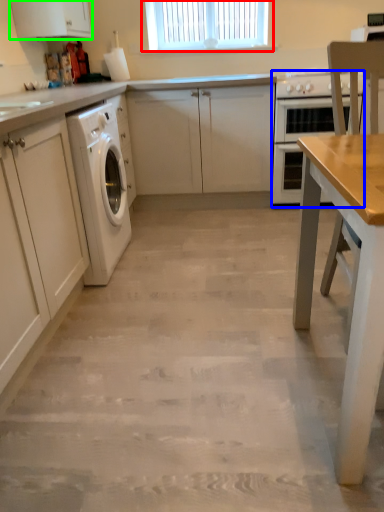
Question: Which object is positioned closest to window (highlighted by a red box)? Select from home appliance (highlighted by a blue box) and cabinetry (highlighted by a green box).

Choices:
 (A) home appliance
 (B) cabinetry

Answer: (A)